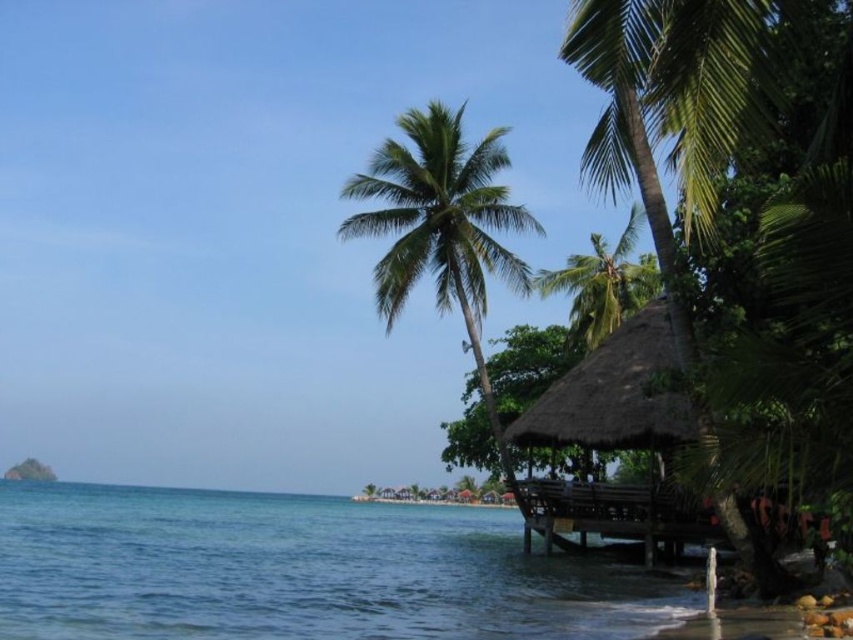
You are planning to set up a small tent for a beach picnic. You have two spots in mind near the green leafy palm tree at center and the thatched wood hut at right. Which location would provide more shade due to the size of the objects?

The green leafy palm tree at center is larger in size than the thatched wood hut at right, so it would provide more shade for your tent.

You are planning to take a photo of the clear blue water at lower left and the green leafy palm tree at center from the beach. Which object will occupy more space in your photo?

The clear blue water at lower left will occupy more space in the photo since it is bigger than the green leafy palm tree at center according to the description.